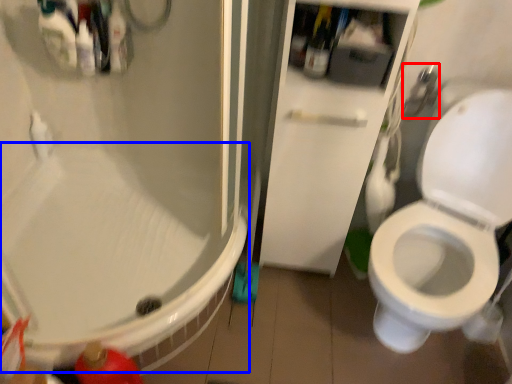
Question: Which of the following is the farthest to the observer, shower (highlighted by a red box) or bath (highlighted by a blue box)?

Choices:
 (A) shower
 (B) bath

Answer: (A)